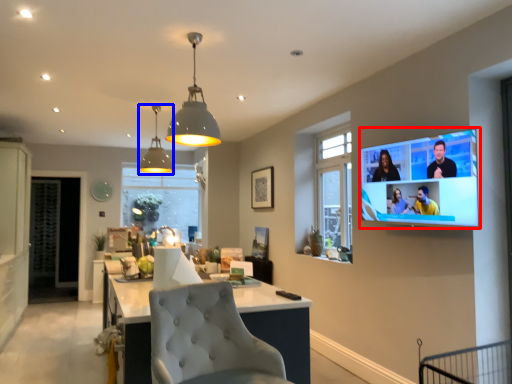
Question: Among these objects, which one is nearest to the camera, tv show (highlighted by a red box) or lamp (highlighted by a blue box)?

Choices:
 (A) tv show
 (B) lamp

Answer: (A)